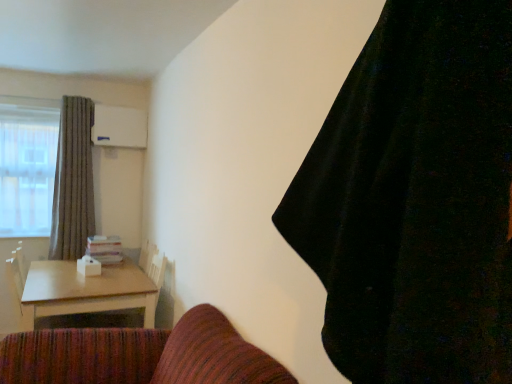
Question: Is light brown wooden table at lower left in front of black velvet curtain at upper right, marked as the 2th curtain in a back-to-front arrangement?

Choices:
 (A) no
 (B) yes

Answer: (A)

Question: Considering the relative sizes of light brown wooden table at lower left and black velvet curtain at upper right, the second curtain positioned from the left, in the image provided, is light brown wooden table at lower left wider than black velvet curtain at upper right, the second curtain positioned from the left,?

Choices:
 (A) yes
 (B) no

Answer: (A)

Question: Can you confirm if light brown wooden table at lower left is smaller than black velvet curtain at upper right, marked as the 2th curtain in a back-to-front arrangement?

Choices:
 (A) yes
 (B) no

Answer: (B)

Question: Is light brown wooden table at lower left at the left side of black velvet curtain at upper right, marked as the 2th curtain in a back-to-front arrangement?

Choices:
 (A) no
 (B) yes

Answer: (B)

Question: From the image's perspective, is light brown wooden table at lower left on top of black velvet curtain at upper right, which is the 1th curtain from front to back?

Choices:
 (A) no
 (B) yes

Answer: (A)

Question: From a real-world perspective, is light brown wooden table at lower left physically located above or below gray textured curtain at left, which appears as the second curtain when viewed from the right?

Choices:
 (A) above
 (B) below

Answer: (B)

Question: In terms of height, does light brown wooden table at lower left look taller or shorter compared to gray textured curtain at left, marked as the first curtain in a left-to-right arrangement?

Choices:
 (A) short
 (B) tall

Answer: (A)

Question: In the image, is light brown wooden table at lower left positioned in front of or behind gray textured curtain at left, marked as the second curtain in a front-to-back arrangement?

Choices:
 (A) front
 (B) behind

Answer: (A)

Question: Looking at the image, does light brown wooden table at lower left seem bigger or smaller compared to gray textured curtain at left, marked as the first curtain in a left-to-right arrangement?

Choices:
 (A) big
 (B) small

Answer: (A)

Question: Is point [x=68, y=274] positioned closer to the camera than point [x=424, y=306]?

Choices:
 (A) closer
 (B) farther

Answer: (B)

Question: Is light brown wooden table at lower left bigger or smaller than black velvet curtain at upper right, which is the 1th curtain from front to back?

Choices:
 (A) small
 (B) big

Answer: (B)

Question: In terms of width, does light brown wooden table at lower left look wider or thinner when compared to black velvet curtain at upper right, the 1th curtain when ordered from right to left?

Choices:
 (A) wide
 (B) thin

Answer: (A)

Question: Is light brown wooden table at lower left to the left or to the right of black velvet curtain at upper right, which is the 1th curtain from front to back, in the image?

Choices:
 (A) left
 (B) right

Answer: (A)

Question: Looking at their shapes, would you say gray textured curtain at left, marked as the second curtain in a front-to-back arrangement, is wider or thinner than light brown wooden table at lower left?

Choices:
 (A) wide
 (B) thin

Answer: (B)

Question: Is point (88, 175) positioned closer to the camera than point (27, 279)?

Choices:
 (A) farther
 (B) closer

Answer: (A)